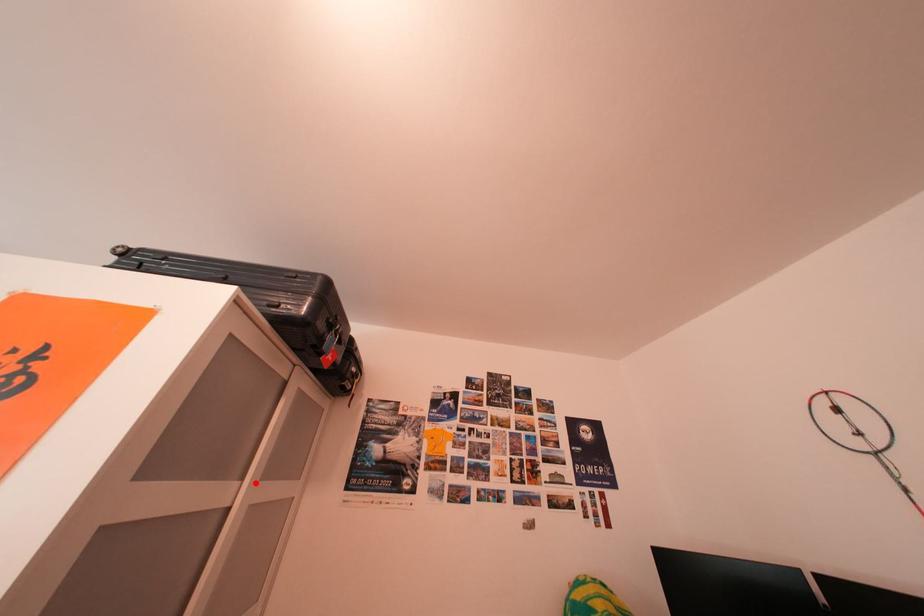
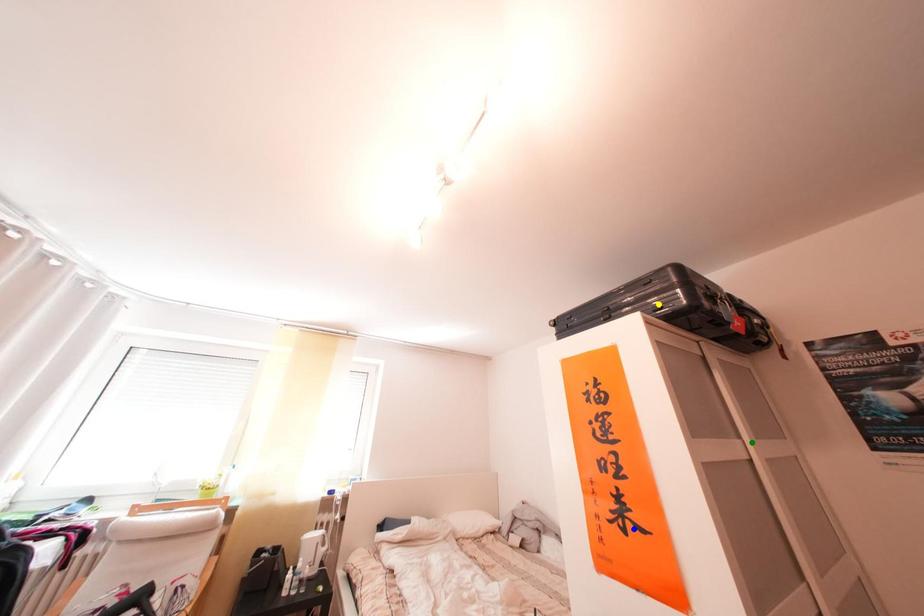
Question: I am providing you with two images of the same scene from different viewpoints. A red point is marked on the first image. You are given multiple points on the second image. Which point in image 2 is actually the same real-world point as the red point in image 1?

Choices:
 (A) blue point
 (B) green point
 (C) yellow point

Answer: (B)